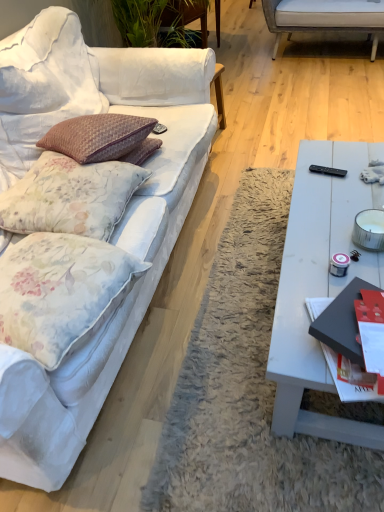
Image resolution: width=384 pixels, height=512 pixels. Identify the location of free space above white matte coffee table at right (from a real-world perspective). (332, 243).